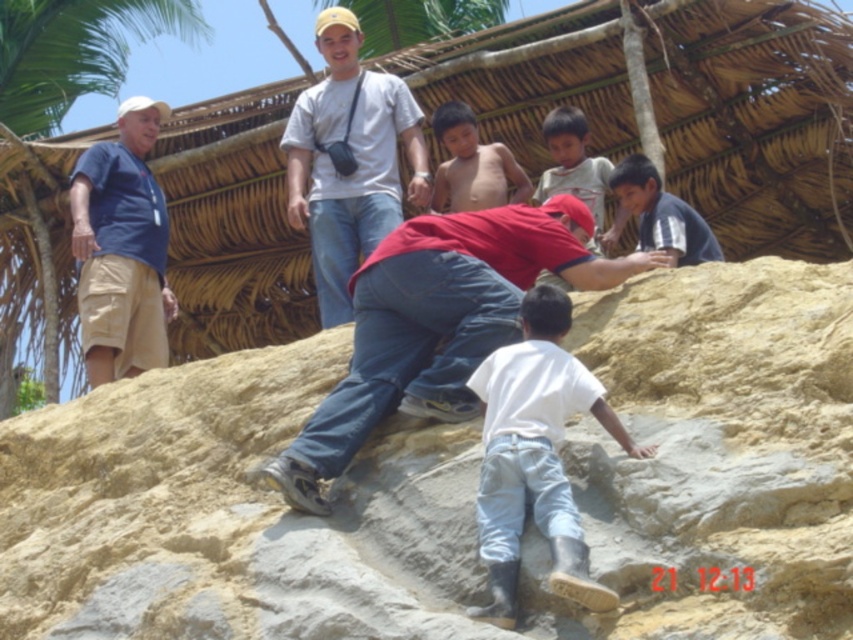
Question: Can you confirm if green leafy palm tree at upper left is positioned below skinny bare torso at center?

Choices:
 (A) no
 (B) yes

Answer: (A)

Question: Which point is closer to the camera taking this photo?

Choices:
 (A) (132, 371)
 (B) (479, 188)
 (C) (372, 124)

Answer: (A)

Question: In this image, where is denim jeans at center located relative to white cotton shirt at lower center?

Choices:
 (A) above
 (B) below

Answer: (A)

Question: Estimate the real-world distances between objects in this image. Which object is farther from the denim jeans at center?

Choices:
 (A) blue cotton shirt at left
 (B) light brown sandy rock at center

Answer: (A)

Question: Among these objects, which one is farthest from the camera?

Choices:
 (A) white cotton shirt at lower center
 (B) white cotton shirt at upper center
 (C) light brown skin at upper center
 (D) skinny bare torso at center

Answer: (D)

Question: Does skinny bare torso at center have a lesser width compared to light brown skin at upper center?

Choices:
 (A) no
 (B) yes

Answer: (A)